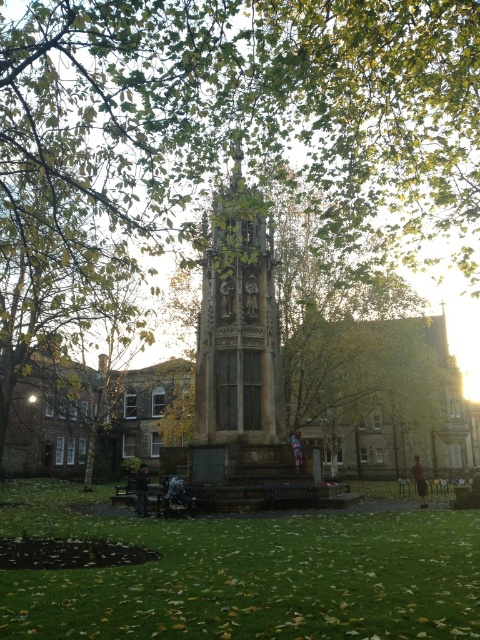
Does point (410, 573) come closer to viewer compared to point (231, 196)?

Yes, point (410, 573) is in front of point (231, 196).

Is point (162, 557) more distant than point (236, 452)?

No, (162, 557) is in front of (236, 452).

In the scene shown: Who is more forward, [173,568] or [236,440]?

Point [173,568] is in front.

You are a GUI agent. You are given a task and a screenshot of the screen. Output one action in this format:
    pyautogui.click(x=<x>, y=<y>)
    Task: Click on the green grass at lower center
    The image size is (480, 640).
    Given the screenshot: What is the action you would take?
    pyautogui.click(x=245, y=573)